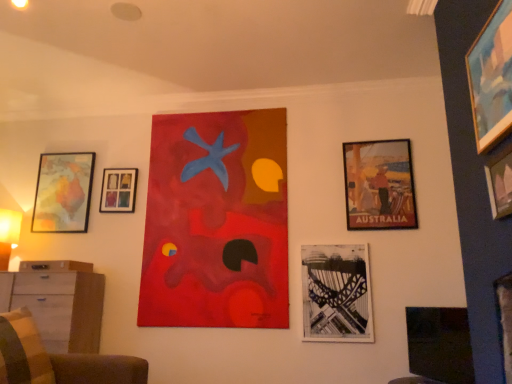
Question: Which direction should I rotate to look at matte acrylic painting at center, acting as the fifth picture frame starting from the right?

Choices:
 (A) right
 (B) left

Answer: (B)

Question: Considering the relative positions of wooden dresser at lower left and matte acrylic painting at center, which ranks as the 3th picture frame in left-to-right order, in the image provided, is wooden dresser at lower left behind matte acrylic painting at center, which ranks as the 3th picture frame in left-to-right order,?

Choices:
 (A) yes
 (B) no

Answer: (B)

Question: Is wooden dresser at lower left oriented towards matte acrylic painting at center, acting as the 4th picture frame starting from the front?

Choices:
 (A) no
 (B) yes

Answer: (A)

Question: Is wooden dresser at lower left positioned with its back to matte acrylic painting at center, acting as the 4th picture frame starting from the front?

Choices:
 (A) no
 (B) yes

Answer: (A)

Question: From a real-world perspective, does wooden dresser at lower left stand above matte acrylic painting at center, acting as the fifth picture frame starting from the right?

Choices:
 (A) no
 (B) yes

Answer: (A)

Question: Can we say wooden dresser at lower left lies outside matte acrylic painting at center, acting as the fifth picture frame starting from the right?

Choices:
 (A) no
 (B) yes

Answer: (B)

Question: Is wooden dresser at lower left positioned in front of matte acrylic painting at center, which ranks as the 3th picture frame in left-to-right order?

Choices:
 (A) no
 (B) yes

Answer: (B)

Question: Is there a large distance between matte paper poster at right, the 6th picture frame in the left-to-right sequence, and matte black picture frame at lower right, which is the 6th picture frame in back-to-front order?

Choices:
 (A) no
 (B) yes

Answer: (A)

Question: Can you confirm if matte paper poster at right, the 6th picture frame in the left-to-right sequence, is positioned to the left of matte black picture frame at lower right, the first picture frame viewed from the right?

Choices:
 (A) no
 (B) yes

Answer: (B)

Question: Considering the relative sizes of matte paper poster at right, which appears as the third picture frame when viewed from the back, and matte black picture frame at lower right, the first picture frame viewed from the right, in the image provided, is matte paper poster at right, which appears as the third picture frame when viewed from the back, smaller than matte black picture frame at lower right, the first picture frame viewed from the right,?

Choices:
 (A) yes
 (B) no

Answer: (A)

Question: From the image's perspective, is matte paper poster at right, the 6th picture frame in the left-to-right sequence, on top of matte black picture frame at lower right, which is counted as the 2th picture frame, starting from the front?

Choices:
 (A) yes
 (B) no

Answer: (A)

Question: From a real-world perspective, is matte paper poster at right, the fifth picture frame when ordered from front to back, on matte black picture frame at lower right, the first picture frame viewed from the right?

Choices:
 (A) no
 (B) yes

Answer: (B)

Question: Is matte paper poster at right, which appears as the third picture frame when viewed from the back, not within matte black picture frame at lower right, which is counted as the 2th picture frame, starting from the front?

Choices:
 (A) yes
 (B) no

Answer: (A)

Question: Is matte paper poster at right, the 2th picture frame positioned from the right, positioned with its back to matte wooden map at left, which ranks as the seventh picture frame in front-to-back order?

Choices:
 (A) no
 (B) yes

Answer: (A)